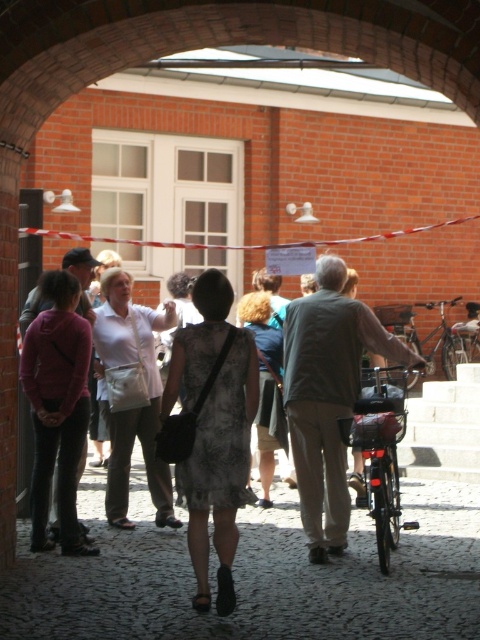
Does dark gray fabric jacket at center have a larger size compared to white fabric apron at center?

Indeed, dark gray fabric jacket at center has a larger size compared to white fabric apron at center.

Which is below, dark gray fabric jacket at center or white fabric apron at center?

white fabric apron at center

Which is in front, point (381, 333) or point (128, 438)?

Point (381, 333) is in front.

Locate an element on the screen. This screenshot has width=480, height=640. dark gray fabric jacket at center is located at coordinates (327, 396).

Can you confirm if matte pink sweater at left is thinner than concrete staircase at center?

Correct, matte pink sweater at left's width is less than concrete staircase at center's.

This screenshot has width=480, height=640. What do you see at coordinates (58, 406) in the screenshot?
I see `matte pink sweater at left` at bounding box center [58, 406].

Which is behind, point (38, 516) or point (441, 426)?

Point (441, 426)

The image size is (480, 640). Identify the location of matte pink sweater at left. (58, 406).

Can you confirm if matte gray dress at center is smaller than dark gray fabric jacket at center?

Yes, matte gray dress at center is smaller than dark gray fabric jacket at center.

Does matte gray dress at center come in front of dark gray fabric jacket at center?

No, matte gray dress at center is further to the viewer.

Where is `matte gray dress at center`? This screenshot has width=480, height=640. matte gray dress at center is located at coordinates (214, 429).